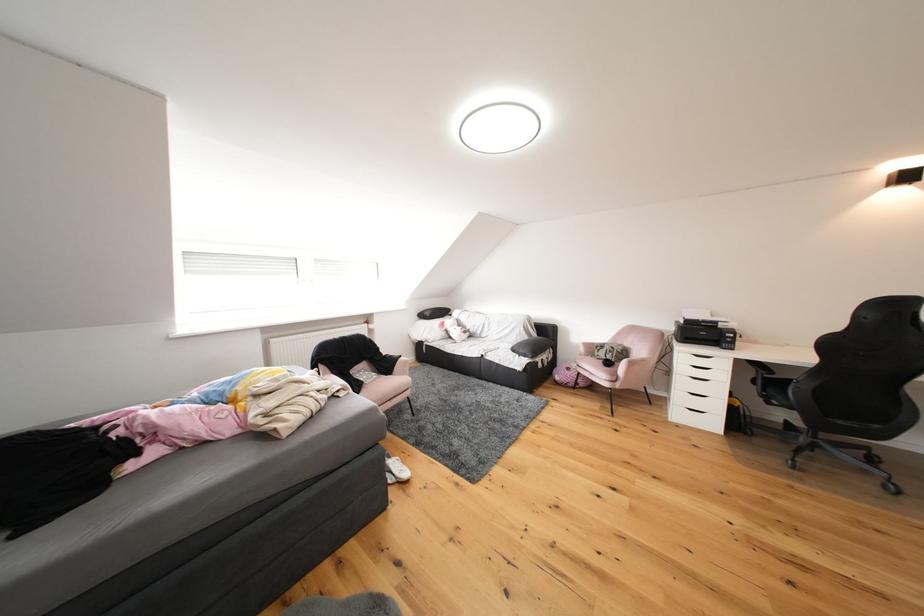
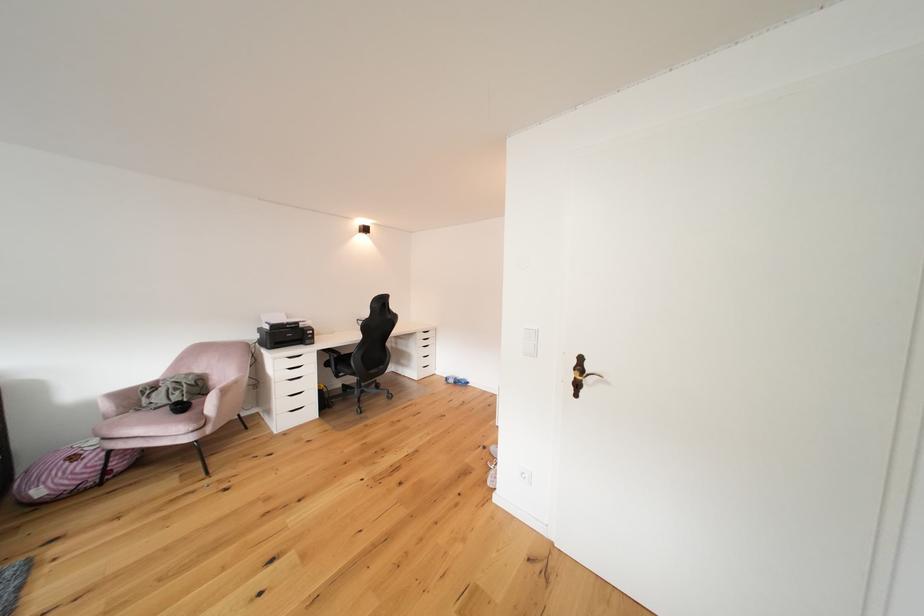
Locate, in the second image, the point that corresponds to (829,395) in the first image.

(372, 362)